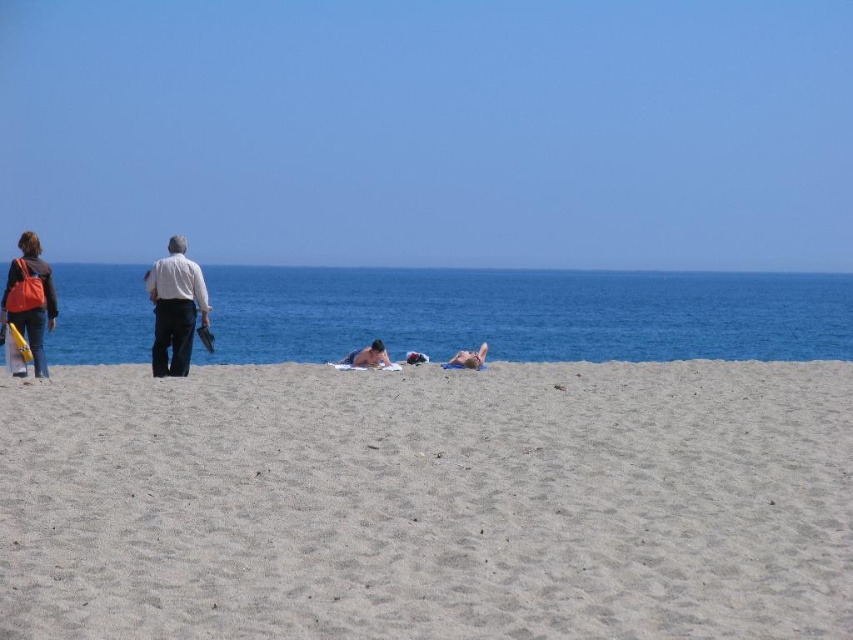
Is point (782, 74) closer to viewer compared to point (457, 365)?

No, it is behind (457, 365).

Does blue sky at upper center appear on the left side of smooth tan skin at center?

Incorrect, blue sky at upper center is not on the left side of smooth tan skin at center.

Is point (556, 228) closer to viewer compared to point (479, 360)?

That is False.

What are the coordinates of `blue sky at upper center` in the screenshot? It's located at (431, 131).

Between blue water at center and smooth skin at center, which one is positioned lower?

smooth skin at center is below.

Between blue water at center and smooth skin at center, which one appears on the right side from the viewer's perspective?

smooth skin at center is more to the right.

Between point (616, 317) and point (381, 348), which one is positioned in front?

Point (381, 348) is in front.

This screenshot has height=640, width=853. What are the coordinates of `blue water at center` in the screenshot? It's located at (525, 314).

Is white shirt at center below smooth skin at center?

Actually, white shirt at center is above smooth skin at center.

Does point (184, 324) come in front of point (375, 340)?

Yes.

What do you see at coordinates (175, 308) in the screenshot? This screenshot has height=640, width=853. I see `white shirt at center` at bounding box center [175, 308].

Identify the location of white shirt at center. This screenshot has height=640, width=853. (175, 308).